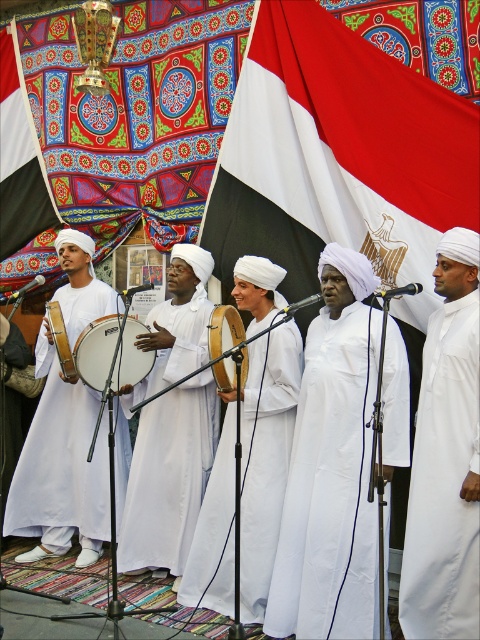
Which is in front, point (422, 156) or point (421, 419)?

Positioned in front is point (421, 419).

Can you confirm if red fabric flag at center is positioned to the left of white matte robe at right?

Indeed, red fabric flag at center is positioned on the left side of white matte robe at right.

Who is more distant from viewer, (252, 179) or (418, 486)?

Positioned behind is point (252, 179).

Find the location of `red fabric flag at center`. red fabric flag at center is located at coordinates (338, 156).

Can you confirm if white matte/soft robe at center is positioned below wooden drum at center?

Yes.

Which is in front, point (287, 362) or point (213, 326)?

Point (287, 362) is more forward.

Identify the location of white matte/soft robe at center. The width and height of the screenshot is (480, 640). (268, 468).

Between point (436, 92) and point (276, 552), which one is positioned behind?

The point (436, 92) is more distant.

Can you confirm if red fabric flag at center is positioned below white smooth robe at center?

Actually, red fabric flag at center is above white smooth robe at center.

Locate an element on the screen. red fabric flag at center is located at coordinates (338, 156).